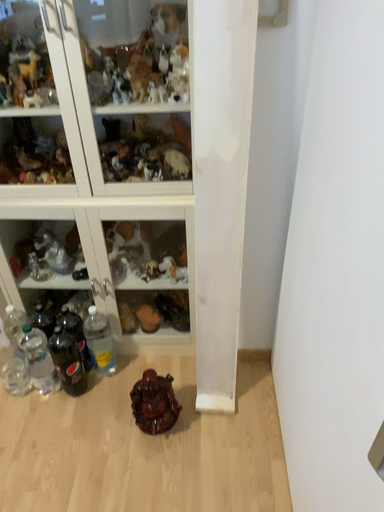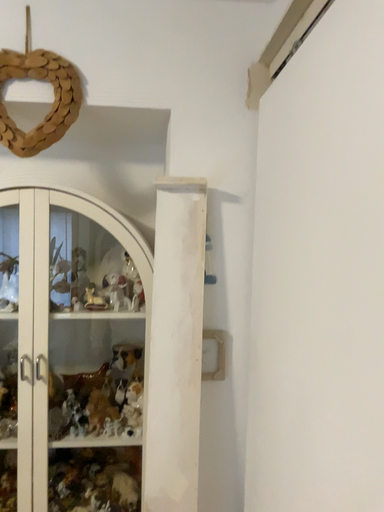
Question: How did the camera likely rotate when shooting the video?

Choices:
 (A) rotated upward
 (B) rotated downward

Answer: (A)